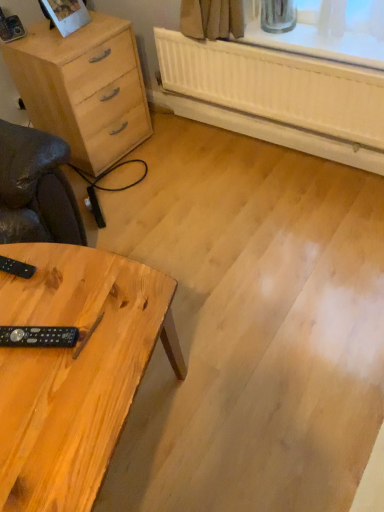
Image resolution: width=384 pixels, height=512 pixels. I want to click on free space to the back side of black plastic remote at lower left, acting as the first control starting from the front, so click(46, 289).